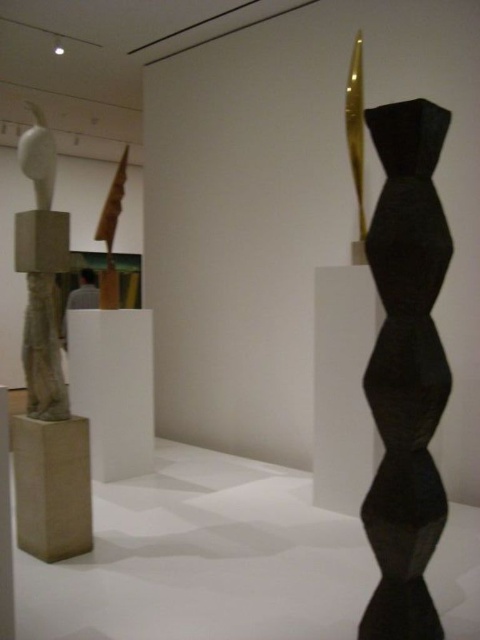
Can you confirm if black matte hexagonal stack at right is taller than matte stone sculpture at left?

Yes.

Can you confirm if black matte hexagonal stack at right is thinner than matte stone sculpture at left?

Incorrect, black matte hexagonal stack at right's width is not less than matte stone sculpture at left's.

Who is more forward, (423, 438) or (36, 141)?

Point (423, 438) is in front.

This screenshot has width=480, height=640. Find the location of `black matte hexagonal stack at right`. black matte hexagonal stack at right is located at coordinates (403, 355).